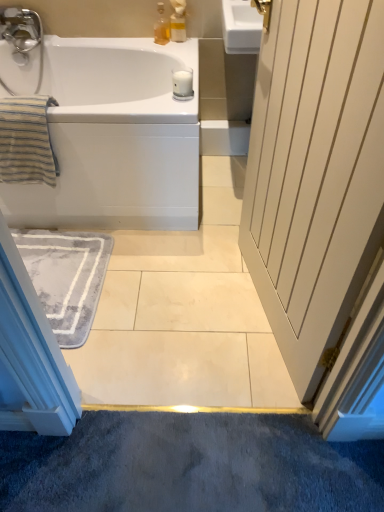
The image size is (384, 512). Describe the element at coordinates (161, 27) in the screenshot. I see `translucent plastic bottle at upper center` at that location.

What do you see at coordinates (178, 23) in the screenshot? I see `translucent plastic soap dispenser at upper center` at bounding box center [178, 23].

Identify the location of striped cotton towel at left. (26, 141).

Where is `white glossy bathtub at upper left`? white glossy bathtub at upper left is located at coordinates (115, 138).

Consider the image. In order to face white glossy bathtub at upper left, should I rotate leftwards or rightwards?

You should look left and rotate roughly 14.314 degrees.

The width and height of the screenshot is (384, 512). What do you see at coordinates (66, 277) in the screenshot? I see `gray soft rug at lower left` at bounding box center [66, 277].

Where is `translucent plastic bottle at upper center`? translucent plastic bottle at upper center is located at coordinates (161, 27).

Is point (176, 31) positioned before point (26, 120)?

No, (176, 31) is further to viewer.

From the image's perspective, relative to striped cotton towel at left, is translucent plastic soap dispenser at upper center above or below?

translucent plastic soap dispenser at upper center is situated higher than striped cotton towel at left in the image.

Is translucent plastic soap dispenser at upper center oriented towards striped cotton towel at left?

No, translucent plastic soap dispenser at upper center is not aimed at striped cotton towel at left.

Is translucent plastic soap dispenser at upper center behind striped cotton towel at left?

Yes, translucent plastic soap dispenser at upper center is further from the camera.

Is striped cotton towel at left taller or shorter than white glossy bathtub at upper left?

Clearly, striped cotton towel at left is shorter compared to white glossy bathtub at upper left.

Is point (29, 109) closer or farther from the camera than point (68, 149)?

Point (29, 109) is closer to the camera than point (68, 149).

Looking at this image, from the image's perspective, which one is positioned higher, striped cotton towel at left or white glossy bathtub at upper left?

white glossy bathtub at upper left appears higher in the image.

Is striped cotton towel at left closer to the viewer compared to white glossy bathtub at upper left?

Yes, it is in front of white glossy bathtub at upper left.

Is white glossy bathtub at upper left wider than striped cotton towel at left?

Indeed, white glossy bathtub at upper left has a greater width compared to striped cotton towel at left.

Is white glossy bathtub at upper left at the left side of striped cotton towel at left?

No, white glossy bathtub at upper left is not to the left of striped cotton towel at left.

Is white glossy bathtub at upper left turned away from striped cotton towel at left?

That's not correct — white glossy bathtub at upper left is not looking away from striped cotton towel at left.

Would you say translucent plastic bottle at upper center contains striped cotton towel at left?

No, striped cotton towel at left is not inside translucent plastic bottle at upper center.

Considering the relative sizes of translucent plastic bottle at upper center and striped cotton towel at left in the image provided, is translucent plastic bottle at upper center bigger than striped cotton towel at left?

No.

Which of these two, translucent plastic bottle at upper center or striped cotton towel at left, stands taller?

striped cotton towel at left.

Which of these two, translucent plastic soap dispenser at upper center or white glossy bathtub at upper left, is smaller?

Smaller between the two is translucent plastic soap dispenser at upper center.

Which is in front, point (185, 31) or point (123, 176)?

The point (123, 176) is more forward.

Is translucent plastic soap dispenser at upper center not close to white glossy bathtub at upper left?

No, translucent plastic soap dispenser at upper center is not far from white glossy bathtub at upper left.

Does point (79, 313) lie behind point (29, 131)?

Yes, point (79, 313) is farther from viewer.

From the picture: From a real-world perspective, is gray soft rug at lower left beneath striped cotton towel at left?

Indeed, from a real-world perspective, gray soft rug at lower left is positioned beneath striped cotton towel at left.

Is gray soft rug at lower left wider than striped cotton towel at left?

Indeed, gray soft rug at lower left has a greater width compared to striped cotton towel at left.

Considering the sizes of objects gray soft rug at lower left and striped cotton towel at left in the image provided, who is taller, gray soft rug at lower left or striped cotton towel at left?

striped cotton towel at left is taller.

Is translucent plastic soap dispenser at upper center bigger than gray soft rug at lower left?

No, translucent plastic soap dispenser at upper center is not bigger than gray soft rug at lower left.

Between translucent plastic soap dispenser at upper center and gray soft rug at lower left, which one has less height?

gray soft rug at lower left is shorter.

Which object is more forward, translucent plastic soap dispenser at upper center or gray soft rug at lower left?

gray soft rug at lower left is in front.

Identify the location of toiletry that is above the striped cotton towel at left (from the image's perspective). (178, 23).

Where is `bath towel located above the white glossy bathtub at upper left (from a real-world perspective)`? Image resolution: width=384 pixels, height=512 pixels. bath towel located above the white glossy bathtub at upper left (from a real-world perspective) is located at coordinates (26, 141).

Considering their positions, is translucent plastic soap dispenser at upper center positioned further to translucent plastic bottle at upper center than striped cotton towel at left?

striped cotton towel at left is positioned further to the anchor translucent plastic bottle at upper center.

From the image, which object appears to be farther from translucent plastic bottle at upper center, striped cotton towel at left or translucent plastic soap dispenser at upper center?

Among the two, striped cotton towel at left is located further to translucent plastic bottle at upper center.

Based on their spatial positions, is translucent plastic soap dispenser at upper center or white glossy bathtub at upper left closer to gray soft rug at lower left?

white glossy bathtub at upper left lies closer to gray soft rug at lower left than the other object.

When comparing their distances from striped cotton towel at left, does white glossy bathtub at upper left or translucent plastic soap dispenser at upper center seem closer?

Based on the image, white glossy bathtub at upper left appears to be nearer to striped cotton towel at left.

Considering their positions, is white glossy bathtub at upper left positioned further to translucent plastic bottle at upper center than translucent plastic soap dispenser at upper center?

Among the two, white glossy bathtub at upper left is located further to translucent plastic bottle at upper center.

In the scene shown: Based on their spatial positions, is translucent plastic bottle at upper center or translucent plastic soap dispenser at upper center closer to gray soft rug at lower left?

Based on the image, translucent plastic bottle at upper center appears to be nearer to gray soft rug at lower left.

Based on their spatial positions, is gray soft rug at lower left or translucent plastic bottle at upper center closer to white glossy bathtub at upper left?

gray soft rug at lower left is positioned closer to the anchor white glossy bathtub at upper left.

From the image, which object appears to be nearer to gray soft rug at lower left, translucent plastic bottle at upper center or white glossy bathtub at upper left?

Among the two, white glossy bathtub at upper left is located nearer to gray soft rug at lower left.

Image resolution: width=384 pixels, height=512 pixels. I want to click on bath towel that lies between translucent plastic soap dispenser at upper center and gray soft rug at lower left from top to bottom, so click(x=26, y=141).

This screenshot has height=512, width=384. What are the coordinates of `bathtub between translucent plastic soap dispenser at upper center and striped cotton towel at left vertically` in the screenshot? It's located at (115, 138).

The image size is (384, 512). Find the location of `soap dispenser that lies between translucent plastic soap dispenser at upper center and white glossy bathtub at upper left from top to bottom`. soap dispenser that lies between translucent plastic soap dispenser at upper center and white glossy bathtub at upper left from top to bottom is located at coordinates (161, 27).

In order to click on bathtub between translucent plastic soap dispenser at upper center and gray soft rug at lower left from top to bottom in this screenshot , I will do `click(115, 138)`.